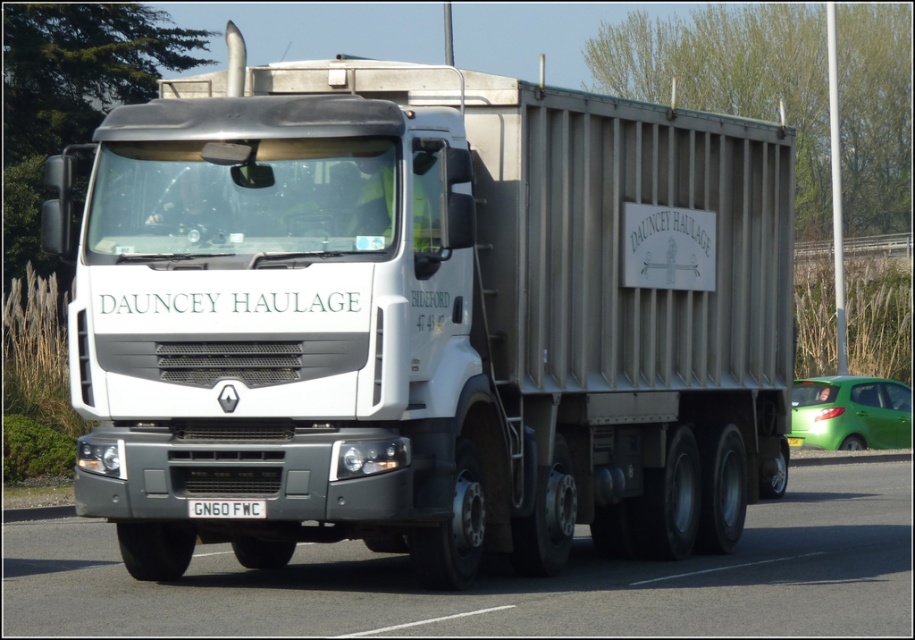
Question: Which is farther from the white matte truck at center?

Choices:
 (A) gray asphalt highway at center
 (B) green matte hatchback at right
 (C) white metallic license plate at center

Answer: (B)

Question: Which of the following is the closest to the observer?

Choices:
 (A) gray asphalt highway at center
 (B) white matte truck at center
 (C) green matte hatchback at right
 (D) white metallic license plate at center

Answer: (A)

Question: Is white matte truck at center wider than green matte hatchback at right?

Choices:
 (A) yes
 (B) no

Answer: (B)

Question: Which point is closer to the camera taking this photo?

Choices:
 (A) (232, 506)
 (B) (676, 596)
 (C) (449, 188)

Answer: (A)

Question: Can you confirm if white matte truck at center is smaller than white metallic license plate at center?

Choices:
 (A) yes
 (B) no

Answer: (B)

Question: Can you confirm if green matte hatchback at right is positioned below white metallic license plate at center?

Choices:
 (A) yes
 (B) no

Answer: (A)